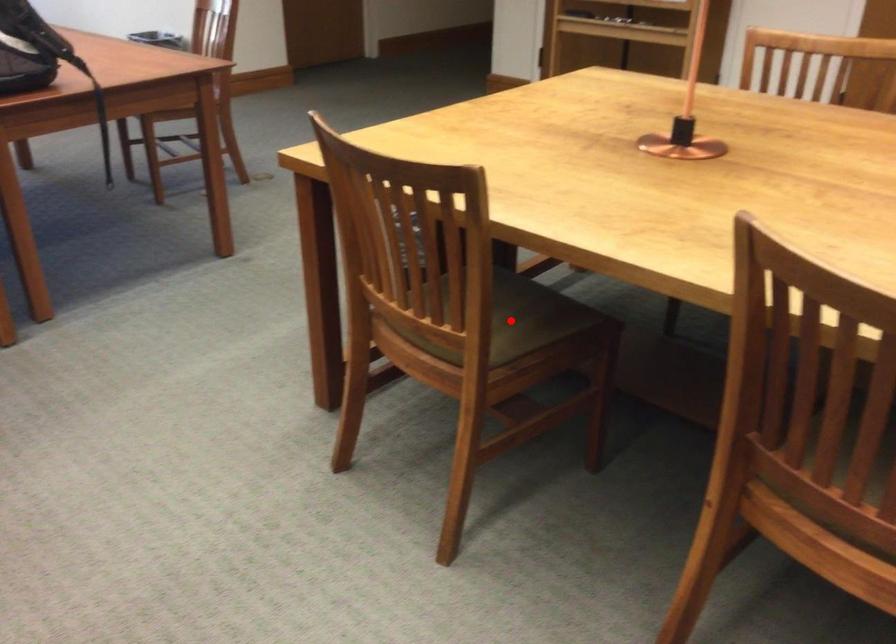
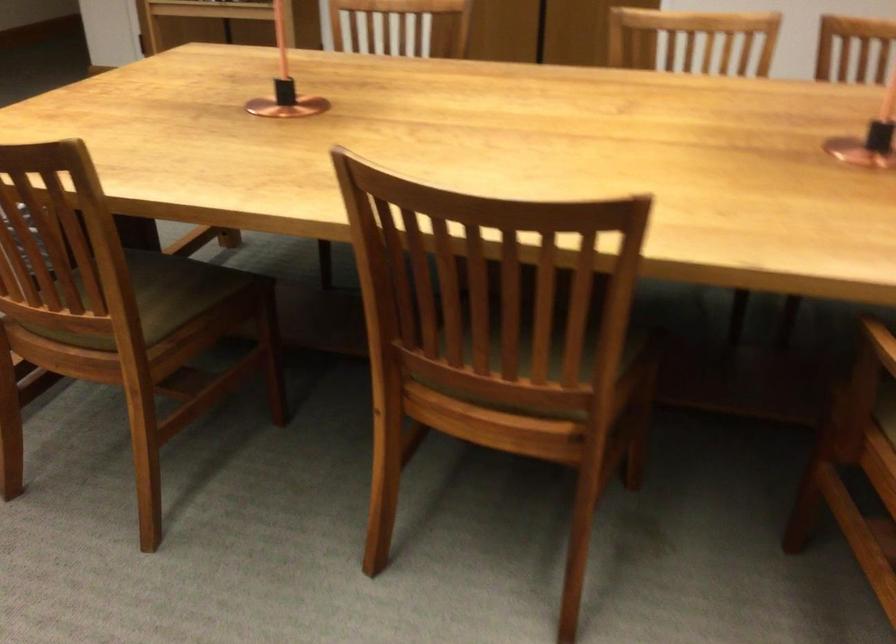
Where in the second image is the point corresponding to the highlighted location from the first image?

(159, 297)